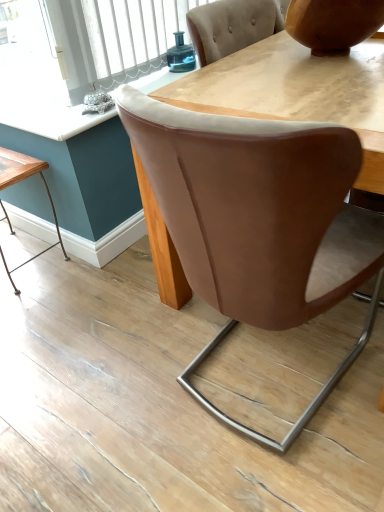
Question: In the image, is teal glass jar at upper center positioned in front of or behind matte wooden table at center?

Choices:
 (A) behind
 (B) front

Answer: (A)

Question: Is point (192, 54) closer or farther from the camera than point (254, 50)?

Choices:
 (A) farther
 (B) closer

Answer: (A)

Question: Which object is the farthest from the brown leather chair at center?

Choices:
 (A) wooden table at lower left
 (B) matte brown vase at upper right
 (C) matte wooden table at center
 (D) teal glass jar at upper center

Answer: (D)

Question: Which object is positioned closest to the wooden table at lower left?

Choices:
 (A) matte brown vase at upper right
 (B) brown leather chair at center
 (C) matte wooden table at center
 (D) teal glass jar at upper center

Answer: (D)